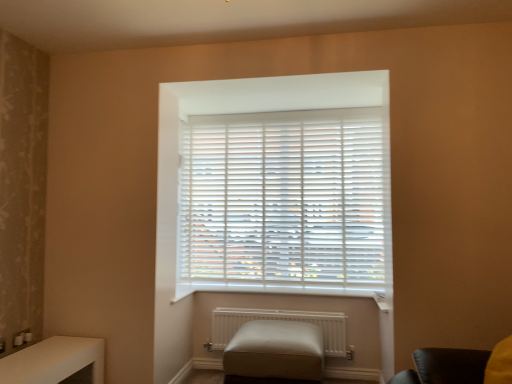
Question: Is white matte blinds at center surrounding beige leather ottoman at center?

Choices:
 (A) no
 (B) yes

Answer: (A)

Question: Can you confirm if white matte blinds at center is wider than beige leather ottoman at center?

Choices:
 (A) no
 (B) yes

Answer: (A)

Question: Is white matte blinds at center in front of beige leather ottoman at center?

Choices:
 (A) yes
 (B) no

Answer: (B)

Question: Can you confirm if white matte blinds at center is taller than beige leather ottoman at center?

Choices:
 (A) no
 (B) yes

Answer: (B)

Question: Is white matte blinds at center positioned with its back to beige leather ottoman at center?

Choices:
 (A) no
 (B) yes

Answer: (A)

Question: Looking at their shapes, would you say beige leather ottoman at center is wider or thinner than white matte radiator at lower center?

Choices:
 (A) wide
 (B) thin

Answer: (A)

Question: From the image's perspective, is beige leather ottoman at center located above or below white matte radiator at lower center?

Choices:
 (A) below
 (B) above

Answer: (A)

Question: In the image, is beige leather ottoman at center on the left side or the right side of white matte radiator at lower center?

Choices:
 (A) right
 (B) left

Answer: (B)

Question: Is point (244, 347) positioned closer to the camera than point (318, 312)?

Choices:
 (A) farther
 (B) closer

Answer: (B)

Question: Is white matte blinds at center inside or outside of beige leather ottoman at center?

Choices:
 (A) inside
 (B) outside

Answer: (B)

Question: Is white matte blinds at center taller or shorter than beige leather ottoman at center?

Choices:
 (A) tall
 (B) short

Answer: (A)

Question: Considering the relative positions of white matte blinds at center and beige leather ottoman at center in the image provided, is white matte blinds at center to the left or to the right of beige leather ottoman at center?

Choices:
 (A) left
 (B) right

Answer: (B)

Question: Considering the positions of white matte blinds at center and beige leather ottoman at center in the image, is white matte blinds at center wider or thinner than beige leather ottoman at center?

Choices:
 (A) thin
 (B) wide

Answer: (A)

Question: Is white glossy table at lower left wider or thinner than white matte radiator at lower center?

Choices:
 (A) thin
 (B) wide

Answer: (B)

Question: From the image's perspective, relative to white matte radiator at lower center, is white glossy table at lower left above or below?

Choices:
 (A) above
 (B) below

Answer: (A)